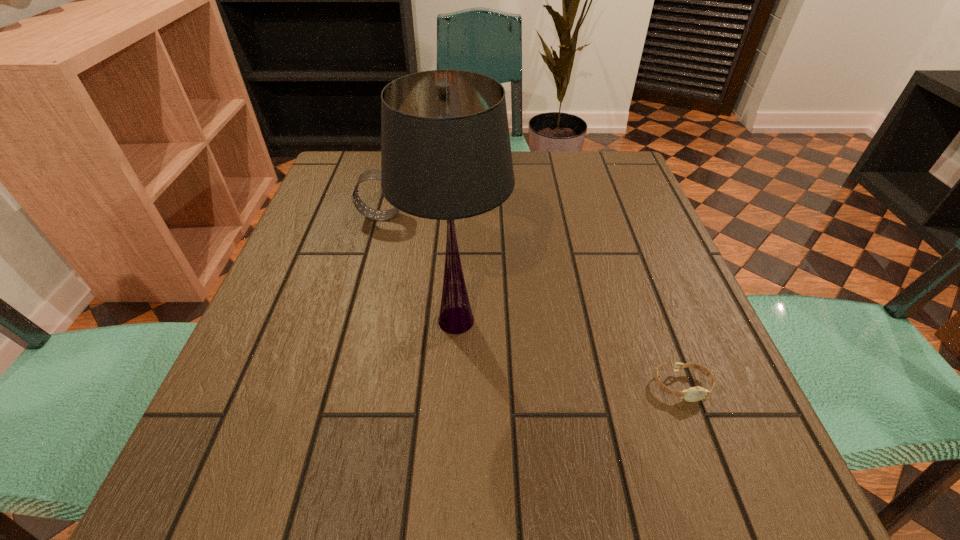
I want to click on object at the right edge, so click(693, 394).

The height and width of the screenshot is (540, 960). In order to click on vacant space at the far edge of the desktop in this screenshot , I will do `click(522, 172)`.

In the image, there is a desktop. At what (x,y) coordinates should I click in order to perform the action: click on vacant space at the near edge. Please return your answer as a coordinate pair (x, y). The width and height of the screenshot is (960, 540). Looking at the image, I should click on (454, 458).

The height and width of the screenshot is (540, 960). Find the location of `free space at the left edge of the desktop`. free space at the left edge of the desktop is located at coordinates (329, 315).

Where is `vacant space at the right edge`? This screenshot has width=960, height=540. vacant space at the right edge is located at coordinates (695, 297).

Find the location of a particular element. This screenshot has height=540, width=960. vacant region at the far left corner of the desktop is located at coordinates (345, 195).

In the image, there is a desktop. Where is `vacant space at the far right corner`? vacant space at the far right corner is located at coordinates (603, 186).

This screenshot has height=540, width=960. I want to click on vacant area that lies between the nearer watch and the left watch, so click(532, 301).

This screenshot has height=540, width=960. I want to click on unoccupied position between the right watch and the second nearest object, so click(x=568, y=353).

I want to click on unoccupied area between the second shortest object and the right watch, so click(532, 301).